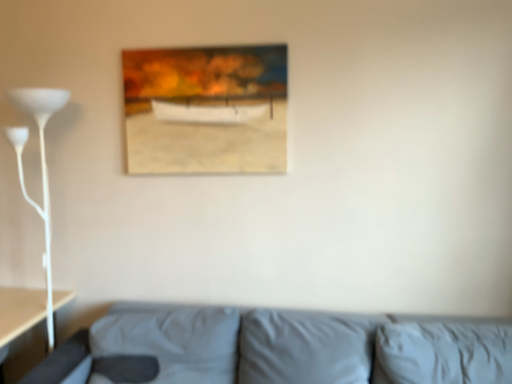
What do you see at coordinates (264, 348) in the screenshot?
I see `gray fabric couch at lower center` at bounding box center [264, 348].

Find the location of a particular element. Image resolution: width=512 pixels, height=384 pixels. wooden frame at upper center is located at coordinates (206, 110).

Find the location of a particular element. white glossy floor lamp at left is located at coordinates (41, 167).

Is wooden frame at upper center positioned beyond the bounds of gray fabric couch at lower center?

Yes.

Which of these two, wooden frame at upper center or gray fabric couch at lower center, stands taller?

With more height is wooden frame at upper center.

From a real-world perspective, is wooden frame at upper center physically above gray fabric couch at lower center?

Yes, from a real-world perspective, wooden frame at upper center is on top of gray fabric couch at lower center.

Measure the distance from wooden frame at upper center to gray fabric couch at lower center.

wooden frame at upper center is 36.57 inches from gray fabric couch at lower center.

Is white glossy floor lamp at left facing towards gray fabric couch at lower center?

No, white glossy floor lamp at left is not turned towards gray fabric couch at lower center.

Measure the distance from white glossy floor lamp at left to gray fabric couch at lower center.

97.63 centimeters.

Is white glossy floor lamp at left not inside gray fabric couch at lower center?

white glossy floor lamp at left lies outside gray fabric couch at lower center's area.

Between white glossy floor lamp at left and gray fabric couch at lower center, which one has less height?

gray fabric couch at lower center.

I want to click on studio couch in front of the wooden frame at upper center, so click(x=264, y=348).

From the image's perspective, is gray fabric couch at lower center below wooden frame at upper center?

Yes, from the image's perspective, gray fabric couch at lower center is beneath wooden frame at upper center.

Is wooden frame at upper center inside gray fabric couch at lower center?

That's incorrect, wooden frame at upper center is not inside gray fabric couch at lower center.

Relative to wooden frame at upper center, is gray fabric couch at lower center in front or behind?

Clearly, gray fabric couch at lower center is in front of wooden frame at upper center.

Is the surface of white glossy floor lamp at left in direct contact with wooden frame at upper center?

white glossy floor lamp at left and wooden frame at upper center are clearly separated.

How different are the orientations of white glossy floor lamp at left and wooden frame at upper center in degrees?

The angle between the facing direction of white glossy floor lamp at left and the facing direction of wooden frame at upper center is 1.15 degrees.

Does white glossy floor lamp at left appear on the left side of wooden frame at upper center?

Yes.

Find the location of `table lamp directly beneath the wooden frame at upper center (from a real-world perspective)`. table lamp directly beneath the wooden frame at upper center (from a real-world perspective) is located at coordinates (41, 167).

From a real-world perspective, between gray fabric couch at lower center and white glossy floor lamp at left, who is vertically higher?

white glossy floor lamp at left, from a real-world perspective.

Is gray fabric couch at lower center bigger than white glossy floor lamp at left?

Yes, gray fabric couch at lower center is bigger than white glossy floor lamp at left.

Relative to white glossy floor lamp at left, is gray fabric couch at lower center in front or behind?

gray fabric couch at lower center is positioned closer to the viewer than white glossy floor lamp at left.

From the image's perspective, would you say gray fabric couch at lower center is shown under white glossy floor lamp at left?

Yes, from the image's perspective, gray fabric couch at lower center is beneath white glossy floor lamp at left.

Does wooden frame at upper center contain white glossy floor lamp at left?

No, wooden frame at upper center does not contain white glossy floor lamp at left.

Is wooden frame at upper center positioned far away from white glossy floor lamp at left?

No.

Identify the location of table lamp that is under the wooden frame at upper center (from a real-world perspective). (41, 167).

The image size is (512, 384). I want to click on studio couch on the right of wooden frame at upper center, so click(x=264, y=348).

Identify the location of table lamp on the left side of gray fabric couch at lower center. Image resolution: width=512 pixels, height=384 pixels. (41, 167).

Estimate the real-world distances between objects in this image. Which object is closer to wooden frame at upper center, gray fabric couch at lower center or white glossy floor lamp at left?

Based on the image, white glossy floor lamp at left appears to be nearer to wooden frame at upper center.

Based on their spatial positions, is white glossy floor lamp at left or gray fabric couch at lower center further from wooden frame at upper center?

Among the two, gray fabric couch at lower center is located further to wooden frame at upper center.

When comparing their distances from gray fabric couch at lower center, does white glossy floor lamp at left or wooden frame at upper center seem further?

Based on the image, white glossy floor lamp at left appears to be further to gray fabric couch at lower center.

Estimate the real-world distances between objects in this image. Which object is closer to gray fabric couch at lower center, wooden frame at upper center or white glossy floor lamp at left?

wooden frame at upper center.

Estimate the real-world distances between objects in this image. Which object is closer to white glossy floor lamp at left, wooden frame at upper center or gray fabric couch at lower center?

wooden frame at upper center.

Based on their spatial positions, is gray fabric couch at lower center or wooden frame at upper center closer to white glossy floor lamp at left?

wooden frame at upper center.

In order to click on table lamp that lies between wooden frame at upper center and gray fabric couch at lower center from top to bottom in this screenshot , I will do `click(41, 167)`.